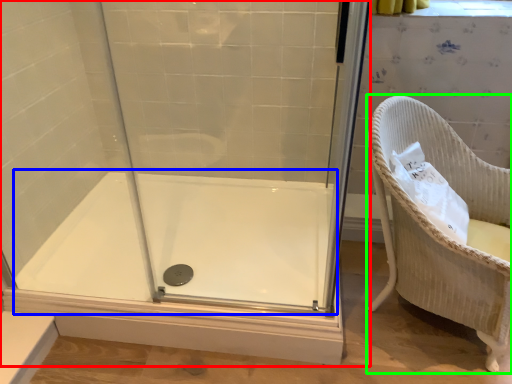
Question: Based on their relative distances, which object is farther from shower door (highlighted by a red box)? Choose from bath (highlighted by a blue box) and furniture (highlighted by a green box).

Choices:
 (A) bath
 (B) furniture

Answer: (B)